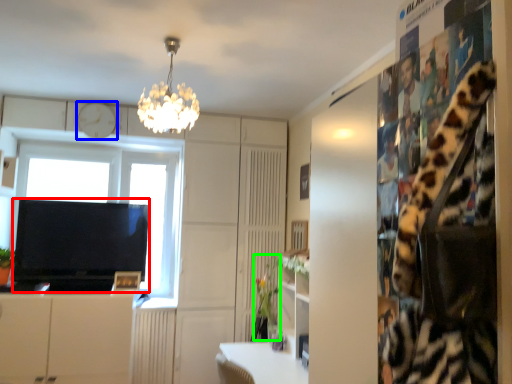
Question: Which object is positioned farthest from television (highlighted by a red box)? Select from clock (highlighted by a blue box) and plant (highlighted by a green box).

Choices:
 (A) clock
 (B) plant

Answer: (B)